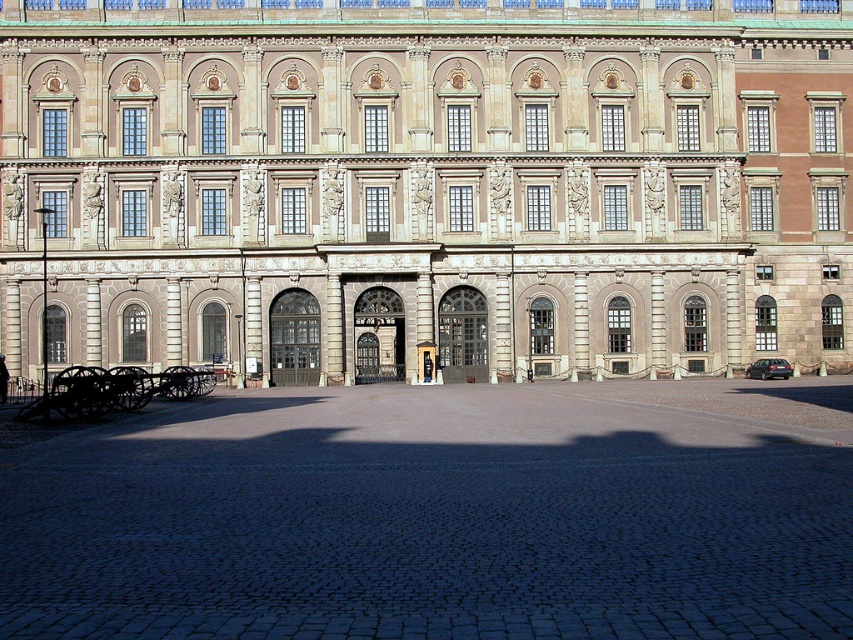
You are a tourist visiting the historical site and want to take a photo that includes both the beige stone palace at center and the black polished cannon at lower left. Which object should you position closer to the camera to ensure both are visible in the frame?

Since the beige stone palace at center is bigger than the black polished cannon at lower left, you should position the black polished cannon at lower left closer to the camera to balance their sizes in the photo.

You are a tour guide explaining the historical site to visitors. You mention both the beige stone palace at center and the black polished cannon at lower left. Which object is wider according to the description?

The beige stone palace at center is wider than the black polished cannon at lower left according to the description.